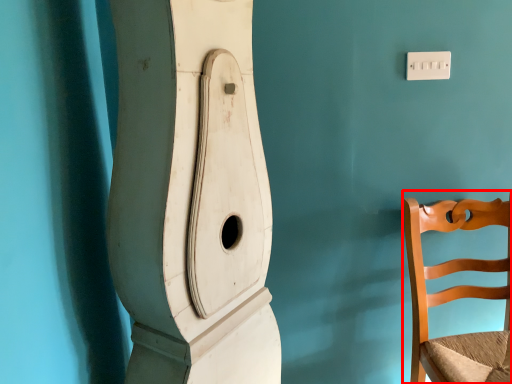
Question: From the image's perspective, where is chair (annotated by the red box) located in relation to light switch in the image?

Choices:
 (A) below
 (B) above

Answer: (A)